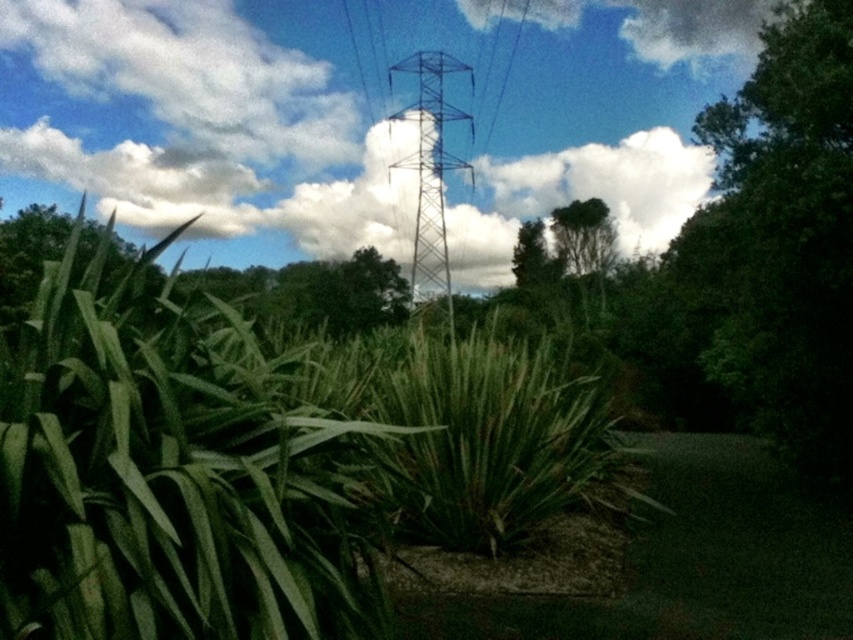
You are standing in the outdoor scene described. You see a point marked at coordinates (430, 170). What object is located at that point?

The point at coordinates (430, 170) indicates the metallic blue tower at center.

You are an architect designing a new building and need to ensure it doesn not block the view of the metallic blue tower at center and the green leafy tree at upper center. Which of the two should you prioritize keeping visible because it is taller?

The metallic blue tower at center is taller than the green leafy tree at upper center, so you should prioritize keeping the metallic blue tower at center visible.

You are a bird flying at an altitude of 10 meters. You see the metallic blue tower at center and the green leafy tree at upper center. Which object is closer to your current position?

The metallic blue tower at center is closer to your current position because it is only 11.88 meters away from the green leafy tree at upper center, but since you are flying at 10 meters altitude, the tower is below your altitude and the tree is above, making the tower closer.